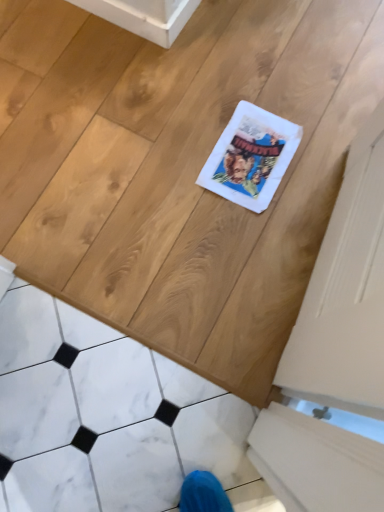
Question: Is white matte screen door at right taller or shorter than white marble tile at lower left?

Choices:
 (A) short
 (B) tall

Answer: (A)

Question: From the image's perspective, is white matte screen door at right located above or below white marble tile at lower left?

Choices:
 (A) below
 (B) above

Answer: (B)

Question: Relative to white marble tile at lower left, is white matte screen door at right in front or behind?

Choices:
 (A) front
 (B) behind

Answer: (B)

Question: Relative to white matte screen door at right, is white marble tile at lower left in front or behind?

Choices:
 (A) behind
 (B) front

Answer: (B)

Question: Does point (125, 446) appear closer or farther from the camera than point (360, 193)?

Choices:
 (A) closer
 (B) farther

Answer: (B)

Question: Is white marble tile at lower left spatially inside white matte screen door at right, or outside of it?

Choices:
 (A) inside
 (B) outside

Answer: (B)

Question: Is white marble tile at lower left to the left or to the right of white matte screen door at right in the image?

Choices:
 (A) right
 (B) left

Answer: (B)